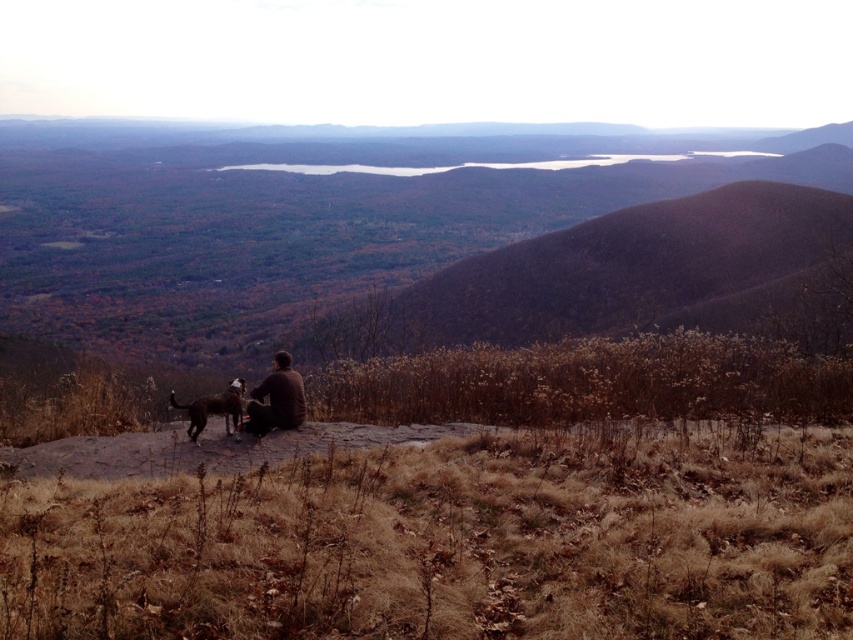
Question: Does brown soft jacket at center have a larger size compared to brown fur dog at center?

Choices:
 (A) no
 (B) yes

Answer: (B)

Question: Can you confirm if brown soft jacket at center is positioned to the left of brown fur dog at center?

Choices:
 (A) yes
 (B) no

Answer: (B)

Question: Which object is closer to the camera taking this photo?

Choices:
 (A) brown soft jacket at center
 (B) brown fur dog at center

Answer: (B)

Question: Is brown soft jacket at center wider than brown fur dog at center?

Choices:
 (A) no
 (B) yes

Answer: (A)